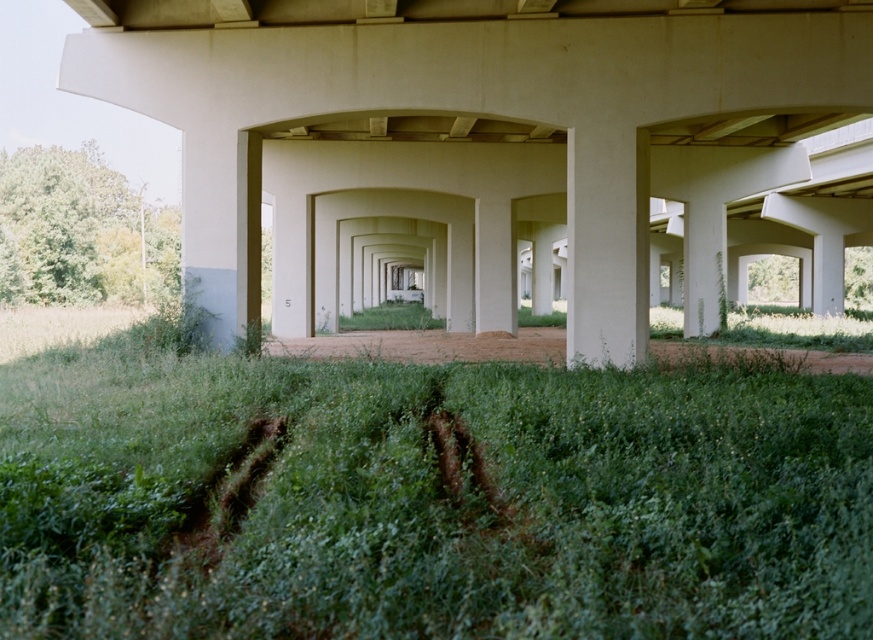
Is smooth concrete overpass at center to the left of dirt/gravel path at center from the viewer's perspective?

Incorrect, smooth concrete overpass at center is not on the left side of dirt/gravel path at center.

Can you confirm if smooth concrete overpass at center is positioned below dirt/gravel path at center?

No, smooth concrete overpass at center is not below dirt/gravel path at center.

Where is `smooth concrete overpass at center`? Image resolution: width=873 pixels, height=640 pixels. smooth concrete overpass at center is located at coordinates (487, 141).

Is white smooth concrete pillar at center closer to camera compared to dirt/gravel path at center?

No, it is behind dirt/gravel path at center.

Does white smooth concrete pillar at center have a smaller size compared to dirt/gravel path at center?

Yes, white smooth concrete pillar at center is smaller than dirt/gravel path at center.

The image size is (873, 640). In order to click on white smooth concrete pillar at center in this screenshot , I will do `click(606, 244)`.

Can you confirm if green grass at center is taller than smooth concrete overpass at center?

Incorrect, green grass at center's height is not larger of smooth concrete overpass at center's.

Is point (449, 529) closer to camera compared to point (720, 134)?

Yes.

Which is in front, point (627, 552) or point (637, 36)?

Point (627, 552) is more forward.

This screenshot has width=873, height=640. I want to click on green grass at center, so click(x=427, y=497).